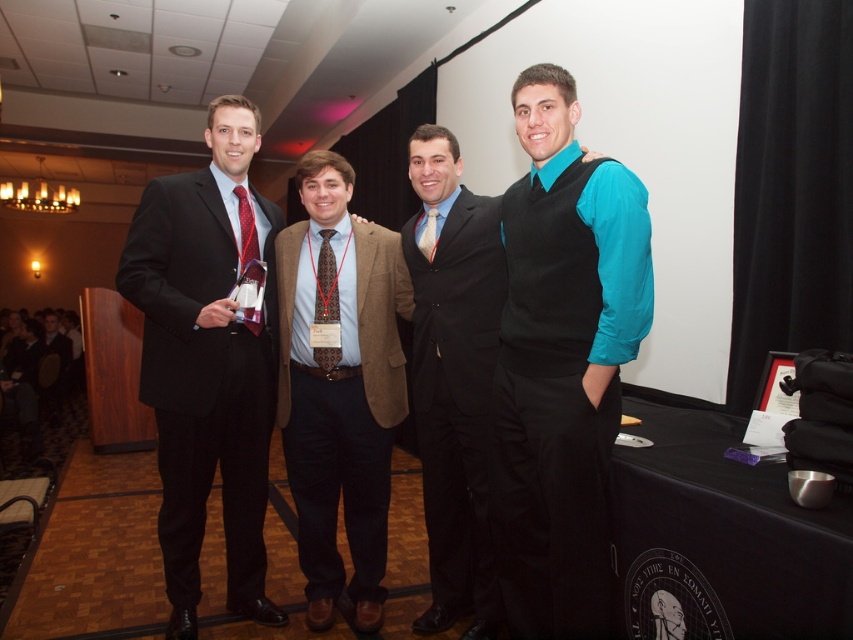
Does point (331, 314) come behind point (428, 236)?

Yes, it is.

Who is shorter, brown textured tie at center or matte red tie at center?

matte red tie at center

In the scene shown: Who is more forward, (328, 310) or (424, 241)?

Point (328, 310) is in front.

I want to click on brown textured tie at center, so click(326, 282).

Locate an element on the screen. teal satin vest at center is located at coordinates (561, 364).

Does teal satin vest at center have a smaller size compared to matte black suit at center?

Yes, teal satin vest at center is smaller than matte black suit at center.

What do you see at coordinates (561, 364) in the screenshot?
I see `teal satin vest at center` at bounding box center [561, 364].

Where is `teal satin vest at center`? teal satin vest at center is located at coordinates (561, 364).

Is black smooth suit at center below brown textured tie at center?

Correct, black smooth suit at center is located below brown textured tie at center.

Locate an element on the screen. The height and width of the screenshot is (640, 853). black smooth suit at center is located at coordinates (456, 392).